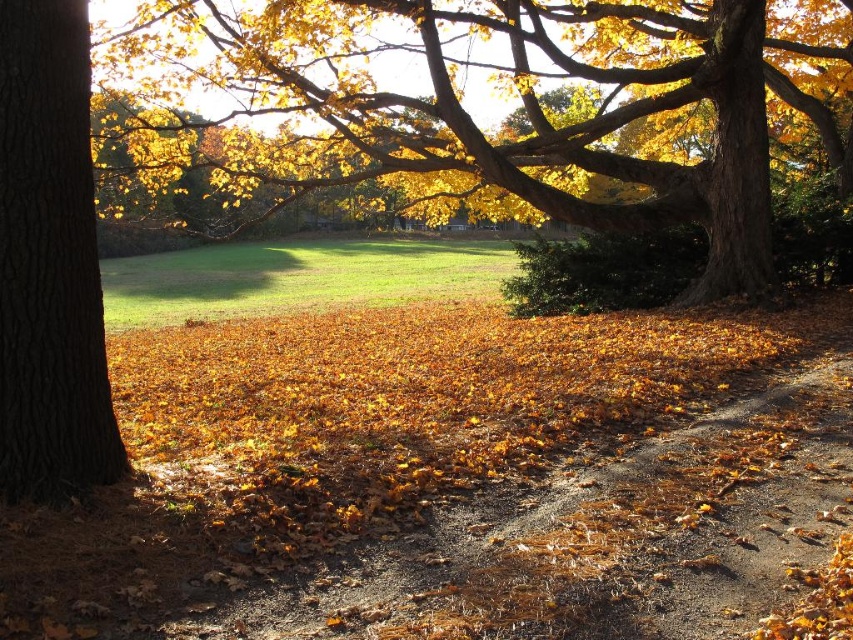
Question: Is golden leafy tree at center wider than brown rough bark tree at left?

Choices:
 (A) no
 (B) yes

Answer: (B)

Question: Which of these objects is positioned closest to the golden leafy tree at center?

Choices:
 (A) brown gravel path at center
 (B) brown rough bark tree at left

Answer: (B)

Question: Among these objects, which one is nearest to the camera?

Choices:
 (A) brown rough bark tree at left
 (B) brown gravel path at center
 (C) golden leafy tree at center

Answer: (B)

Question: Does golden leafy tree at center have a larger size compared to brown rough bark tree at left?

Choices:
 (A) yes
 (B) no

Answer: (A)

Question: Estimate the real-world distances between objects in this image. Which object is closer to the brown rough bark tree at left?

Choices:
 (A) brown gravel path at center
 (B) golden leafy tree at center

Answer: (A)

Question: Can you confirm if golden leafy tree at center is wider than brown rough bark tree at left?

Choices:
 (A) yes
 (B) no

Answer: (A)